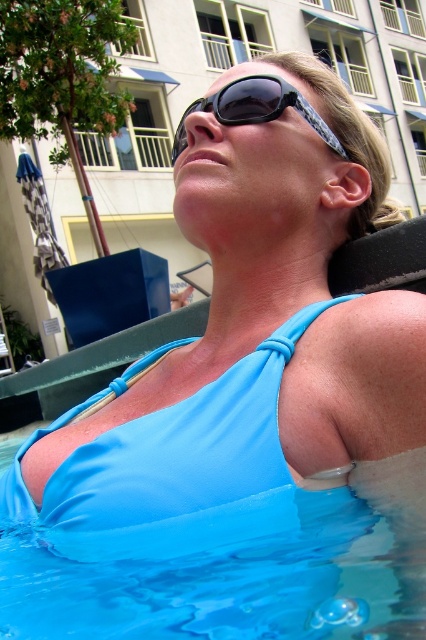
The woman is wearing a matte blue bikini top at upper center and black textured sunglasses at center. From her perspective, which object is positioned to the right?

The black textured sunglasses at center are positioned to the right of the matte blue bikini top at upper center.